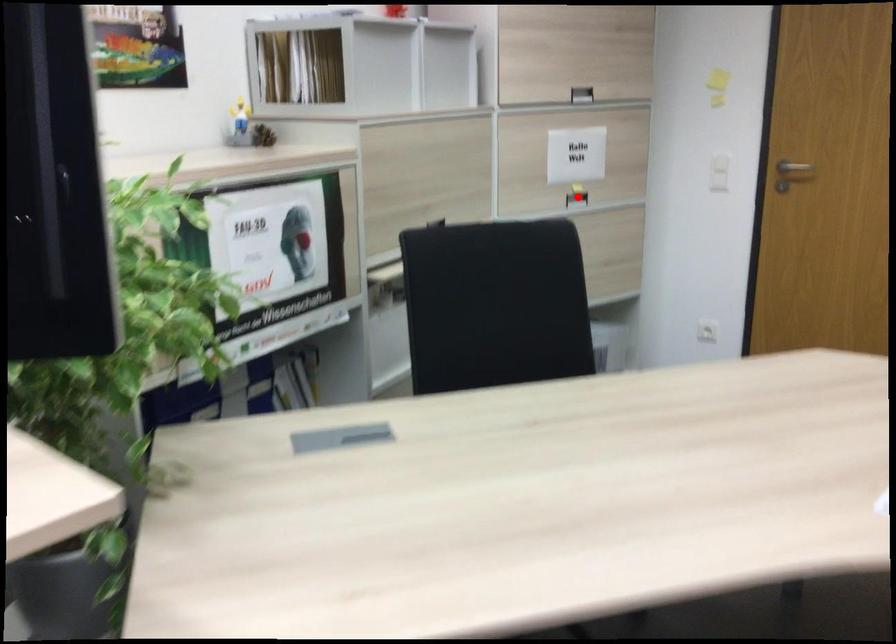
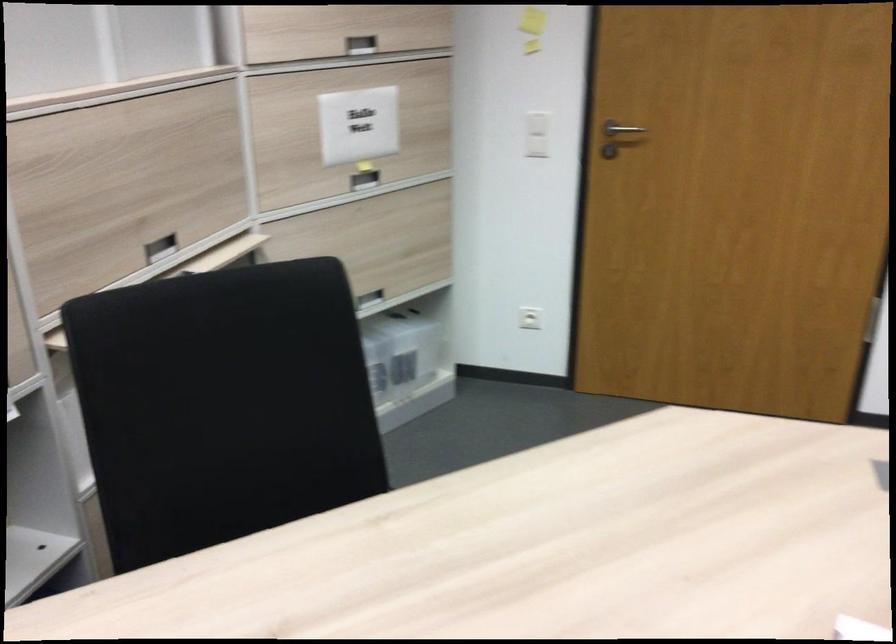
Question: I am providing you with two images of the same scene from different viewpoints. Image1 has a red point marked. In image2, the corresponding 3D location appears at what relative position? Reply with the corresponding letter.

Choices:
 (A) Closer
 (B) Farther

Answer: (A)